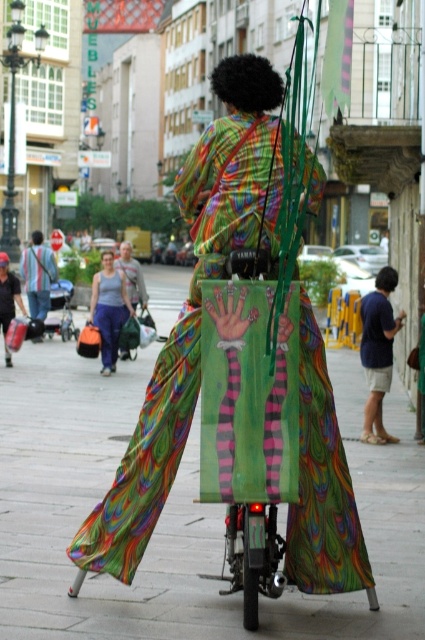
You are a photographer wanting to capture the scene with a wide angle lens that can only focus on objects wider than 1 meter. Are both the multicolored fabric street vendor at center and the matte black bag at left in focus?

The multicolored fabric street vendor at center is thinner than the matte black bag at left. Since the lens requires objects wider than 1 meter, the matte black bag at left may be in focus if it is wider than 1 meter, but the multicolored fabric street vendor at center might not be because it is thinner. However, without knowing the exact width, we can only compare their sizes relative to each other.